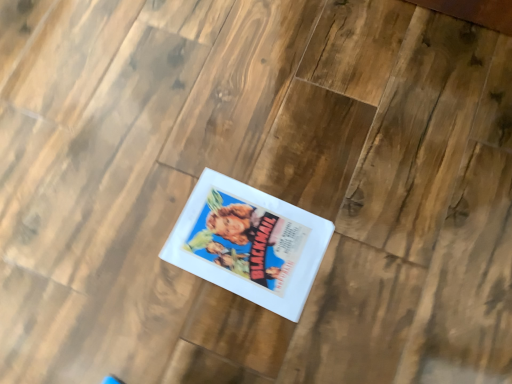
The image size is (512, 384). I want to click on vacant space situated above white glossy paperback book at center (from a real-world perspective), so click(x=252, y=241).